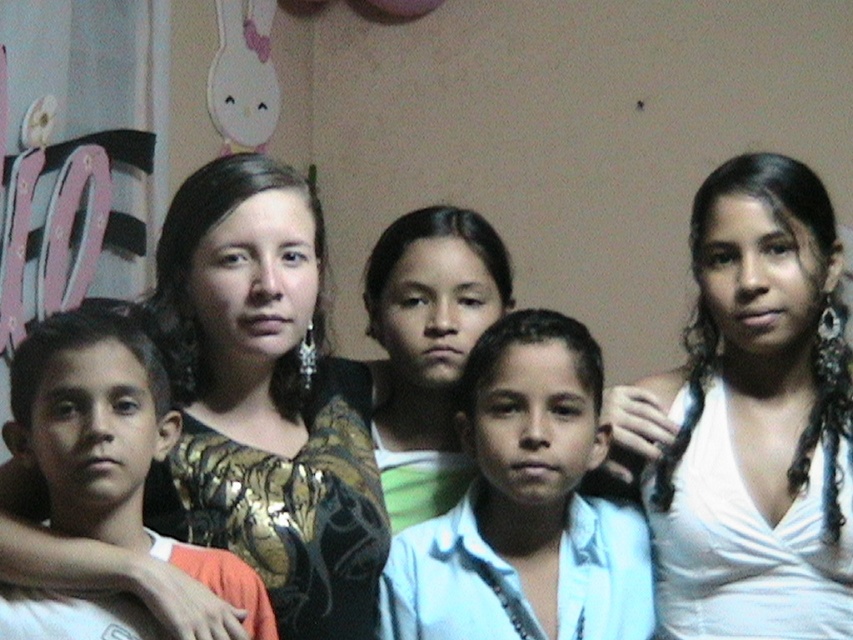
Question: Based on their relative distances, which object is nearer to the white satin dress at upper right?

Choices:
 (A) matte green shirt at center
 (B) light blue shirt at center
 (C) gold sequined blouse at center
 (D) white matte shirt at left

Answer: (B)

Question: In this image, where is white satin dress at upper right located relative to light blue shirt at center?

Choices:
 (A) left
 (B) right

Answer: (B)

Question: Where is gold sequined blouse at center located in relation to matte green shirt at center in the image?

Choices:
 (A) below
 (B) above

Answer: (A)

Question: Estimate the real-world distances between objects in this image. Which object is farther from the white satin dress at upper right?

Choices:
 (A) gold sequined blouse at center
 (B) matte green shirt at center
 (C) light blue shirt at center

Answer: (A)

Question: Which object is positioned farthest from the light blue shirt at center?

Choices:
 (A) gold sequined blouse at center
 (B) white satin dress at upper right

Answer: (A)

Question: Is light blue shirt at center thinner than matte green shirt at center?

Choices:
 (A) no
 (B) yes

Answer: (A)